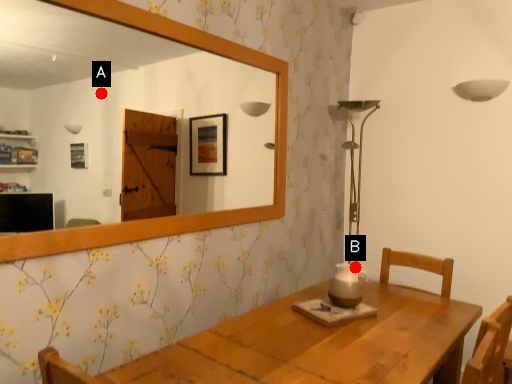
Question: Two points are circled on the image, labeled by A and B beside each circle. Which point is closer to the camera taking this photo?

Choices:
 (A) A is closer
 (B) B is closer

Answer: (B)